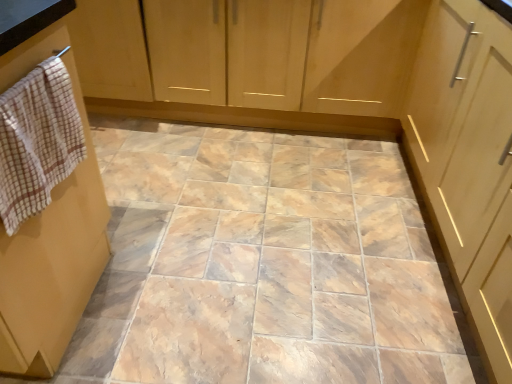
Question: Are white checkered hand towel at left and wooden cabinet at upper left located far from each other?

Choices:
 (A) no
 (B) yes

Answer: (B)

Question: From a real-world perspective, is white checkered hand towel at left located higher than wooden cabinet at upper left?

Choices:
 (A) no
 (B) yes

Answer: (B)

Question: Is the position of white checkered hand towel at left less distant than that of wooden cabinet at upper left?

Choices:
 (A) yes
 (B) no

Answer: (A)

Question: Is white checkered hand towel at left shorter than wooden cabinet at upper left?

Choices:
 (A) no
 (B) yes

Answer: (B)

Question: Can you confirm if white checkered hand towel at left is wider than wooden cabinet at upper left?

Choices:
 (A) yes
 (B) no

Answer: (B)

Question: Does white checkered hand towel at left turn towards wooden cabinet at upper left?

Choices:
 (A) yes
 (B) no

Answer: (A)

Question: Considering the relative sizes of wooden cabinet at upper left and white checkered hand towel at left in the image provided, is wooden cabinet at upper left bigger than white checkered hand towel at left?

Choices:
 (A) no
 (B) yes

Answer: (B)

Question: Is wooden cabinet at upper left not inside white checkered hand towel at left?

Choices:
 (A) no
 (B) yes

Answer: (B)

Question: Does wooden cabinet at upper left turn towards white checkered hand towel at left?

Choices:
 (A) no
 (B) yes

Answer: (B)

Question: Does wooden cabinet at upper left have a lesser width compared to white checkered hand towel at left?

Choices:
 (A) no
 (B) yes

Answer: (A)

Question: Are wooden cabinet at upper left and white checkered hand towel at left beside each other?

Choices:
 (A) no
 (B) yes

Answer: (A)

Question: Would you consider wooden cabinet at upper left to be distant from white checkered hand towel at left?

Choices:
 (A) no
 (B) yes

Answer: (B)

Question: From a real-world perspective, is white checkered hand towel at left positioned above or below wooden cabinet at upper left?

Choices:
 (A) above
 (B) below

Answer: (A)